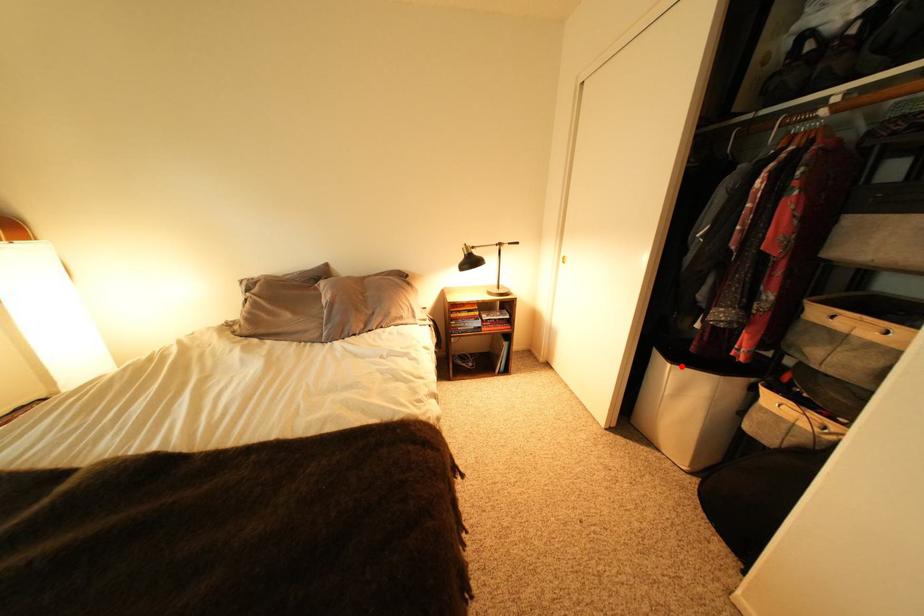
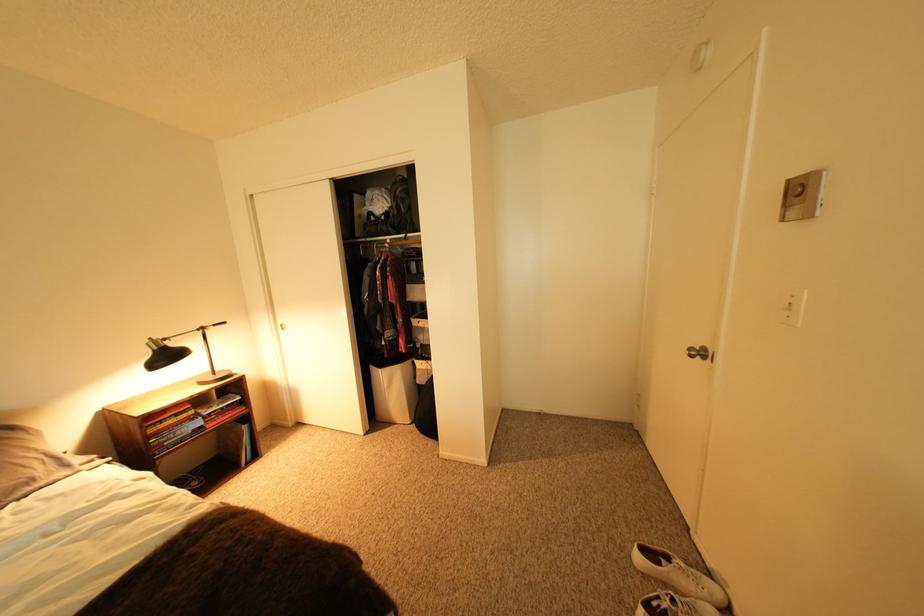
Question: I am providing you with two images of the same scene from different viewpoints. In image1, a red point is highlighted. Considering the same 3D point in image2, which of the following is correct?

Choices:
 (A) It is closer
 (B) It is farther

Answer: (B)